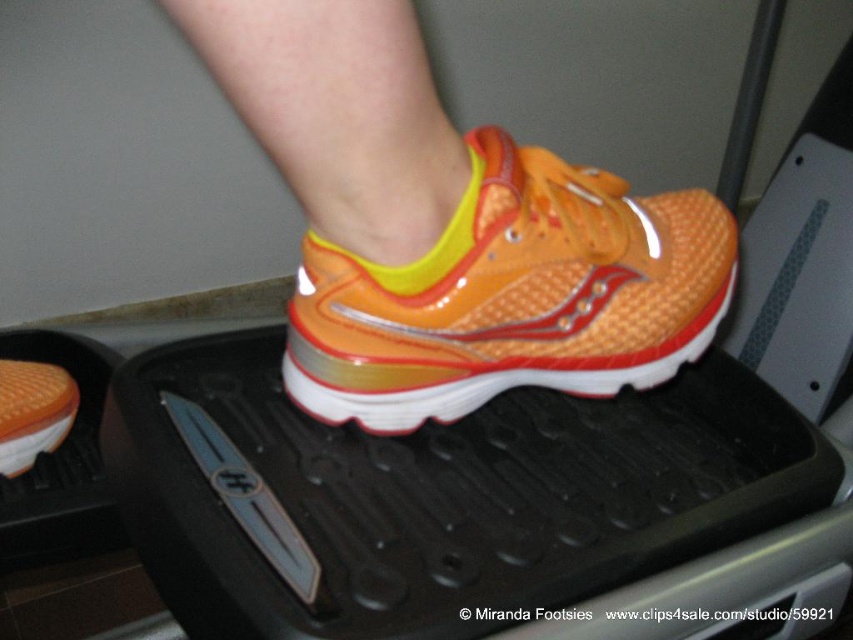
You are standing in front of the treadmill and see two points marked on the treadmill platform. The first point is at coordinate point(677,250) and the second is at point(42,449). Which point is closer to you?

Point(677,250) is closer to the viewer than point(42,449).

You are a photographer trying to capture a detailed shot of both the orange glossy running shoe at center and the orange rubber shoe at center. Since you want to focus on the one closer to you, which one should you choose?

The orange glossy running shoe at center is closer to the viewer than the orange rubber shoe at center, so you should focus on the orange glossy running shoe at center.